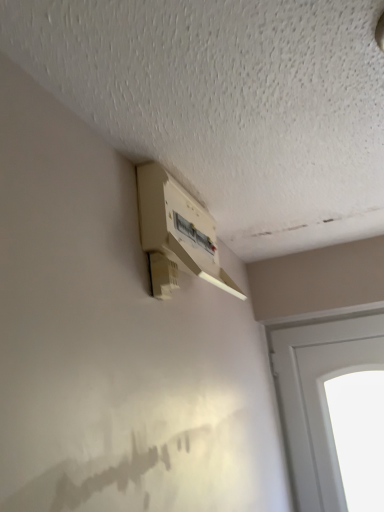
The image size is (384, 512). What do you see at coordinates (177, 233) in the screenshot? I see `beige plastic light switch at upper center` at bounding box center [177, 233].

Identify the location of beige plastic light switch at upper center. The width and height of the screenshot is (384, 512). (177, 233).

What is the approximate height of beige plastic light switch at upper center?

14.14 inches.

Measure the distance between point (163, 176) and camera.

Answer: They are 1.12 meters apart.

Identify the location of beige plastic light switch at upper center. (177, 233).